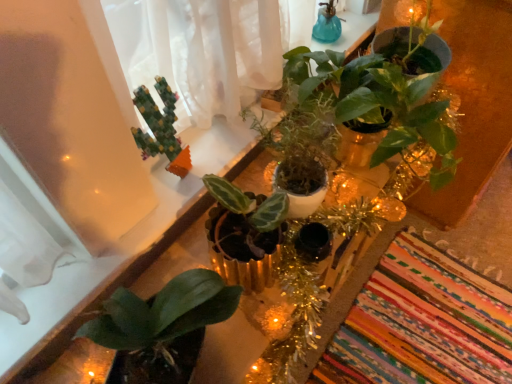
Question: In the image, is green matte plant at center, which appears as the second houseplant when viewed from the left, on the left side or the right side of blue glass vase at upper center?

Choices:
 (A) left
 (B) right

Answer: (A)

Question: Do you think green matte plant at center, which appears as the second houseplant when viewed from the left, is within blue glass vase at upper center, or outside of it?

Choices:
 (A) inside
 (B) outside

Answer: (B)

Question: Which object is the closest to the green matte plant at center?

Choices:
 (A) multicolored woven mat at lower right
 (B) green matte plant at upper center, placed as the 1th houseplant when sorted from right to left
 (C) green mosaic cactus at upper left, placed as the first houseplant when sorted from left to right
 (D) green matte plant at center, which appears as the second houseplant when viewed from the left
 (E) blue glass vase at upper center

Answer: (B)

Question: Which object is positioned farthest from the multicolored woven mat at lower right?

Choices:
 (A) green mosaic cactus at upper left, placed as the first houseplant when sorted from left to right
 (B) green matte plant at center
 (C) blue glass vase at upper center
 (D) green matte plant at upper center, the 3th houseplant in the left-to-right sequence
 (E) green matte plant at center, which appears as the second houseplant when viewed from the left

Answer: (A)